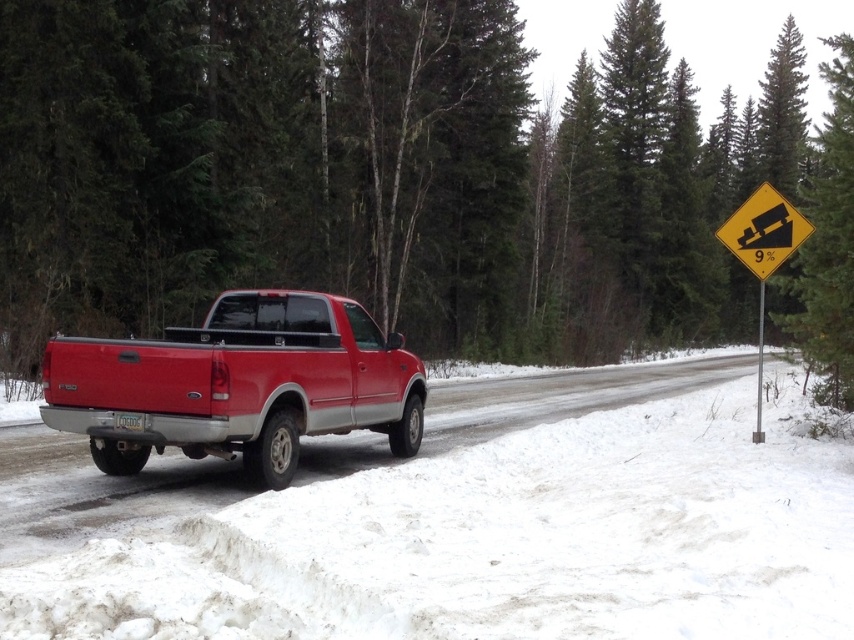
You are standing at the point labeled point (346, 636) and want to walk to the point labeled point (97, 467). Given that both points are on the snowy road, which direction should you face to move towards your destination?

You should face towards the lower right direction because point (97, 467) is further away from the camera compared to point (346, 636).

You are a delivery driver trying to park your shiny red pickup truck at center on the snowy road. The white powdery snow at lower center is in the way. Can you park your truck there without the snow covering the entire vehicle?

The white powdery snow at lower center is taller than the shiny red pickup truck at center, so if you park there, the snow will cover the entire vehicle.